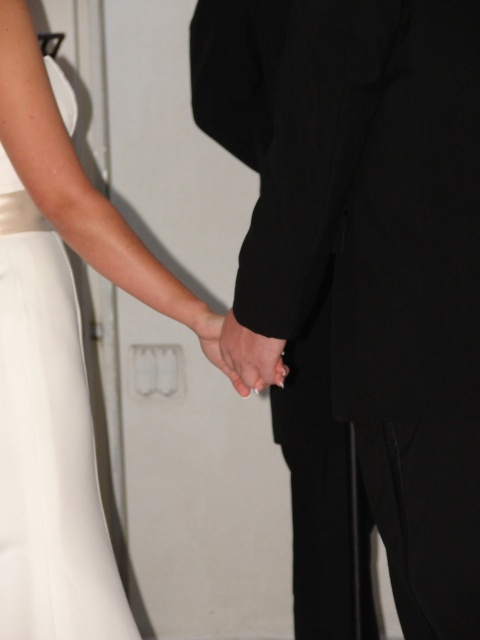
Which is behind, point (477, 516) or point (264, 356)?

The point (264, 356) is more distant.

Which is in front, point (398, 294) or point (211, 353)?

Positioned in front is point (398, 294).

Find the location of a particular element. black smooth suit at center is located at coordinates coord(368,250).

Can you confirm if white satin dress at left is positioned to the right of smooth skin hand at center?

No, white satin dress at left is not to the right of smooth skin hand at center.

Which of these two, white satin dress at left or smooth skin hand at center, stands shorter?

With less height is smooth skin hand at center.

Measure the distance between white satin dress at left and camera.

The distance of white satin dress at left from camera is 1.41 meters.

Locate an element on the screen. This screenshot has width=480, height=640. white satin dress at left is located at coordinates (48, 444).

This screenshot has height=640, width=480. What do you see at coordinates (368, 250) in the screenshot? I see `black smooth suit at center` at bounding box center [368, 250].

Based on the photo, who is more forward, [466,99] or [39,464]?

Point [466,99]

Is point (382, 490) closer to camera compared to point (90, 568)?

Yes, point (382, 490) is in front of point (90, 568).

Identify the location of black smooth suit at center. The image size is (480, 640). (368, 250).